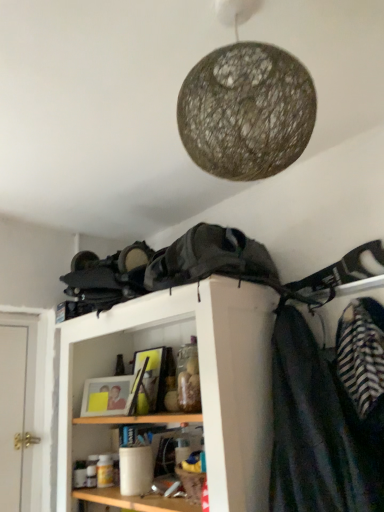
Identify the location of blank space situated above woven natural fiber lampshade at upper center (from a real-world perspective). Image resolution: width=384 pixels, height=512 pixels. (223, 18).